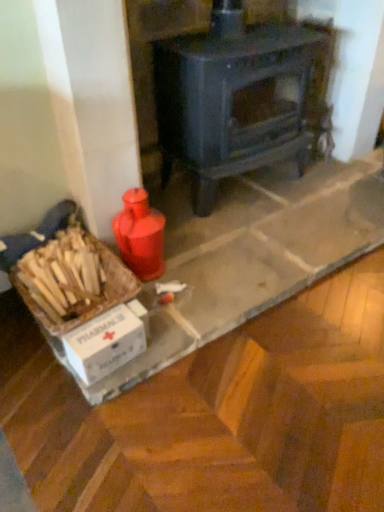
Identify the location of vacant area that lies to the right of matte black wood burning stove at center. Image resolution: width=384 pixels, height=512 pixels. (336, 194).